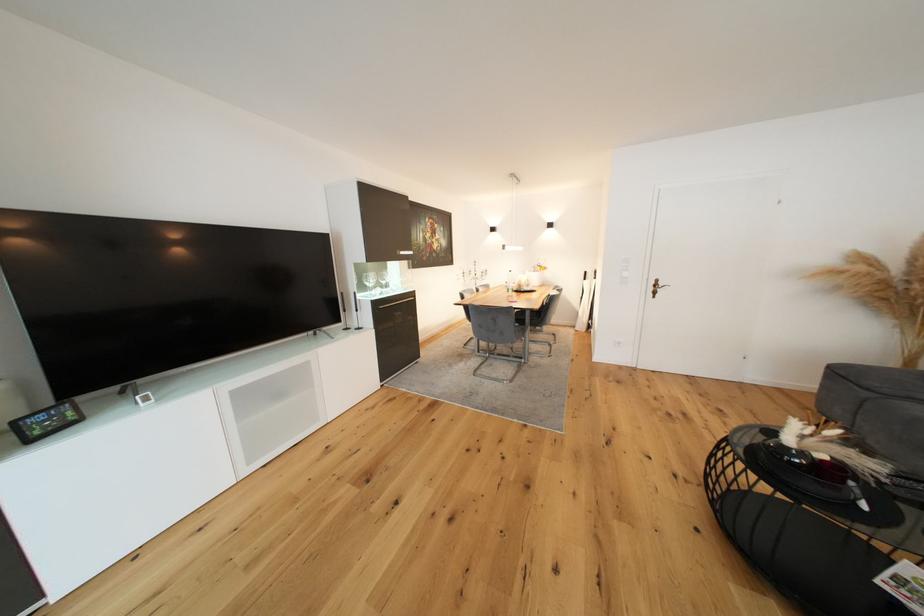
Image resolution: width=924 pixels, height=616 pixels. I want to click on sofa armrest, so click(x=872, y=381).